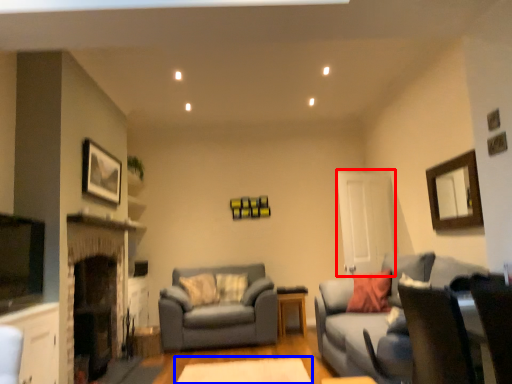
Question: Which object appears closest to the camera in this image, glass door (highlighted by a red box) or round table (highlighted by a blue box)?

Choices:
 (A) glass door
 (B) round table

Answer: (B)